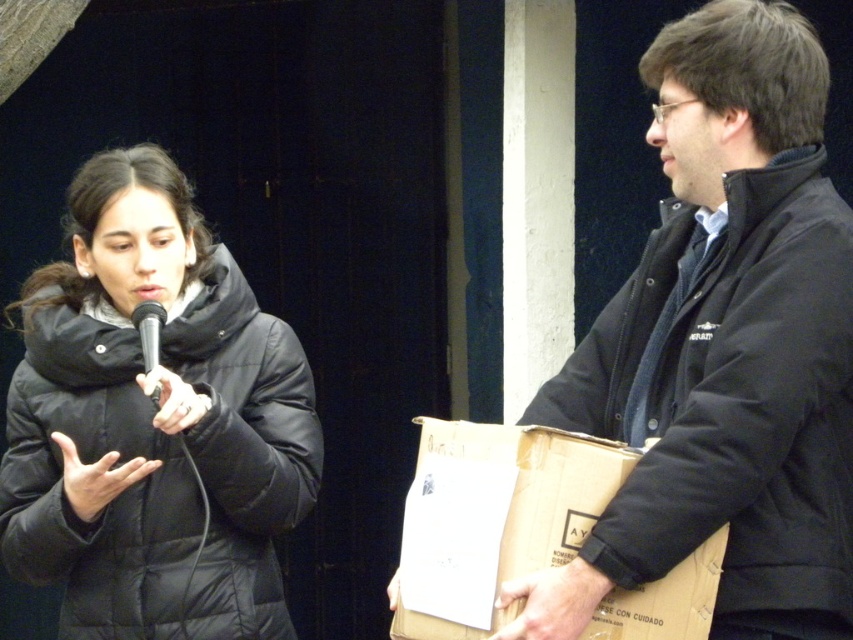
You are a photographer setting up for an event. You notice the black quilted jacket at right and the black matte microphone at center. Which object is located to the right of the microphone?

The black quilted jacket at right is positioned on the right side of the black matte microphone at center.

You are a photographer trying to capture a clear shot of the black puffy jacket at center and the black matte microphone at center. Since the lighting is dim, you want to adjust your camera settings to focus on the object that is closer to the camera. Which object should you focus on?

The black matte microphone at center is behind the black puffy jacket at center, so you should focus on the black puffy jacket at center since it is closer to the camera.

You are a stagehand setting up for a small outdoor event. You need to place a 3.5 feet wide equipment stand between the black quilted jacket at right and the black matte microphone at center. Will there be enough space?

The black quilted jacket at right and black matte microphone at center are 5.03 feet apart from each other. Since the equipment stand is 3.5 feet wide, there is sufficient space between them to place it as the distance is greater than the stand width.